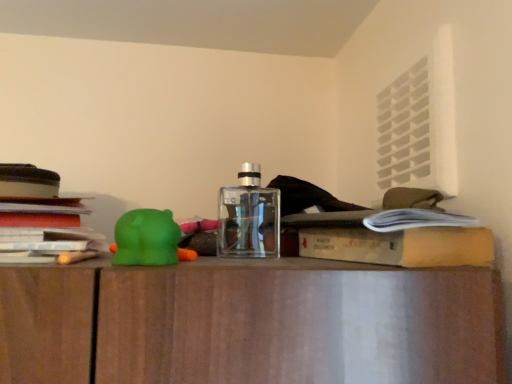
Measure the distance between point (231, 214) and camera.

23.58 inches.

Identify the location of hardcover book at center. The image size is (512, 384). (401, 246).

What do you see at coordinates (401, 246) in the screenshot? The image size is (512, 384). I see `hardcover book at center` at bounding box center [401, 246].

This screenshot has width=512, height=384. What do you see at coordinates (42, 219) in the screenshot?
I see `stacked paper at left` at bounding box center [42, 219].

Where is `transparent glass bottle at center`? This screenshot has width=512, height=384. transparent glass bottle at center is located at coordinates (249, 217).

Looking at this image, between stacked paper at left and green rubber bear at left, which one has smaller width?

With smaller width is green rubber bear at left.

From a real-world perspective, is stacked paper at left positioned over green rubber bear at left based on gravity?

Yes, from a real-world perspective, stacked paper at left is on top of green rubber bear at left.

Between stacked paper at left and green rubber bear at left, which one has larger size?

stacked paper at left is bigger.

In terms of height, does transparent glass bottle at center look taller or shorter compared to hardcover book at center?

transparent glass bottle at center is taller than hardcover book at center.

In the image, is transparent glass bottle at center on the left side or the right side of hardcover book at center?

Based on their positions, transparent glass bottle at center is located to the left of hardcover book at center.

Considering the relative sizes of transparent glass bottle at center and hardcover book at center in the image provided, is transparent glass bottle at center thinner than hardcover book at center?

Correct, the width of transparent glass bottle at center is less than that of hardcover book at center.

The image size is (512, 384). Identify the location of paperback book that appears on the right of transparent glass bottle at center. [401, 246].

Which of these two, hardcover book at center or transparent glass bottle at center, is wider?

With larger width is hardcover book at center.

From the image's perspective, which is below, hardcover book at center or transparent glass bottle at center?

From the image's view, hardcover book at center is below.

Is hardcover book at center far away from transparent glass bottle at center?

That's not correct — hardcover book at center is a little close to transparent glass bottle at center.

What's the angular difference between hardcover book at center and transparent glass bottle at center's facing directions?

The facing directions of hardcover book at center and transparent glass bottle at center are 13.7 degrees apart.

Can you confirm if green rubber bear at left is wider than transparent glass bottle at center?

No.

Which point is more forward, (x=177, y=242) or (x=242, y=168)?

The point (x=177, y=242) is in front.

How different are the orientations of green rubber bear at left and transparent glass bottle at center in degrees?

0.00513 degrees.

From a real-world perspective, is green rubber bear at left physically above transparent glass bottle at center?

Incorrect, from a real-world perspective, green rubber bear at left is lower than transparent glass bottle at center.

Looking at this image, considering the positions of objects green rubber bear at left and hardcover book at center in the image provided, who is more to the left, green rubber bear at left or hardcover book at center?

green rubber bear at left is more to the left.

Between point (176, 236) and point (479, 249), which one is positioned behind?

The point (176, 236) is more distant.

Identify the location of paperback book that appears below the green rubber bear at left (from a real-world perspective). (401, 246).

What's the angular difference between green rubber bear at left and hardcover book at center's facing directions?

The angle between the facing direction of green rubber bear at left and the facing direction of hardcover book at center is 13.7 degrees.

Does point (117, 232) come in front of point (61, 240)?

Yes, it is in front of point (61, 240).

Considering the sizes of objects green rubber bear at left and stacked paper at left in the image provided, who is taller, green rubber bear at left or stacked paper at left?

With more height is stacked paper at left.

Is green rubber bear at left far from stacked paper at left?

That's not correct — green rubber bear at left is a little close to stacked paper at left.

In terms of width, does green rubber bear at left look wider or thinner when compared to stacked paper at left?

Considering their sizes, green rubber bear at left looks slimmer than stacked paper at left.

Considering the positions of points (33, 173) and (399, 258), is point (33, 173) farther from camera compared to point (399, 258)?

Yes, point (33, 173) is farther from viewer.

Where is `book to the left of hardcover book at center`? This screenshot has width=512, height=384. book to the left of hardcover book at center is located at coordinates (x=42, y=219).

From the image's perspective, which one is positioned higher, stacked paper at left or hardcover book at center?

From the image's view, stacked paper at left is above.

Would you say stacked paper at left is outside hardcover book at center?

That's correct, stacked paper at left is outside of hardcover book at center.

At what (x,y) coordinates should I click in order to perform the action: click on toy located above the stacked paper at left (from the image's perspective). Please return your answer as a coordinate pair (x, y). The image size is (512, 384). Looking at the image, I should click on (146, 238).

I want to click on paperback book in front of the transparent glass bottle at center, so pyautogui.click(x=401, y=246).

When comparing their distances from transparent glass bottle at center, does hardcover book at center or green rubber bear at left seem further?

The object further to transparent glass bottle at center is hardcover book at center.

When comparing their distances from green rubber bear at left, does stacked paper at left or transparent glass bottle at center seem further?

stacked paper at left is positioned further to the anchor green rubber bear at left.

When comparing their distances from stacked paper at left, does transparent glass bottle at center or hardcover book at center seem further?

Based on the image, hardcover book at center appears to be further to stacked paper at left.

From the image, which object appears to be farther from transparent glass bottle at center, stacked paper at left or hardcover book at center?

stacked paper at left lies further to transparent glass bottle at center than the other object.

From the image, which object appears to be nearer to hardcover book at center, transparent glass bottle at center or green rubber bear at left?

The object closer to hardcover book at center is transparent glass bottle at center.

When comparing their distances from stacked paper at left, does hardcover book at center or transparent glass bottle at center seem closer?

Based on the image, transparent glass bottle at center appears to be nearer to stacked paper at left.

When comparing their distances from transparent glass bottle at center, does green rubber bear at left or stacked paper at left seem further?

stacked paper at left is further to transparent glass bottle at center.

When comparing their distances from green rubber bear at left, does hardcover book at center or stacked paper at left seem closer?

stacked paper at left.

Identify the location of toy between stacked paper at left and transparent glass bottle at center from left to right. The width and height of the screenshot is (512, 384). (146, 238).

In order to click on toy between stacked paper at left and hardcover book at center in the horizontal direction in this screenshot , I will do `click(146, 238)`.

Find the location of a particular element. bottle located between green rubber bear at left and hardcover book at center in the left-right direction is located at coordinates (249, 217).

Identify the location of bottle situated between stacked paper at left and hardcover book at center from left to right. Image resolution: width=512 pixels, height=384 pixels. (249, 217).